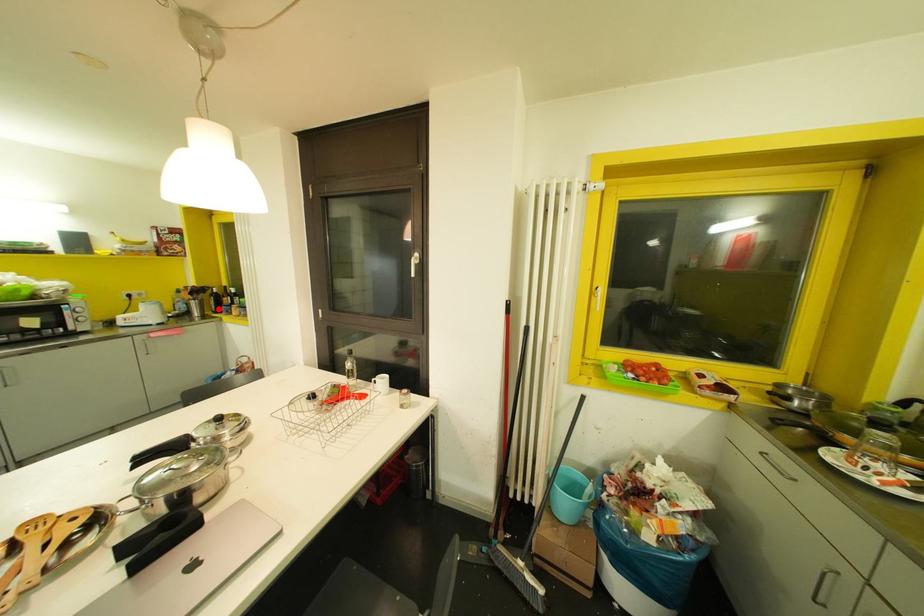
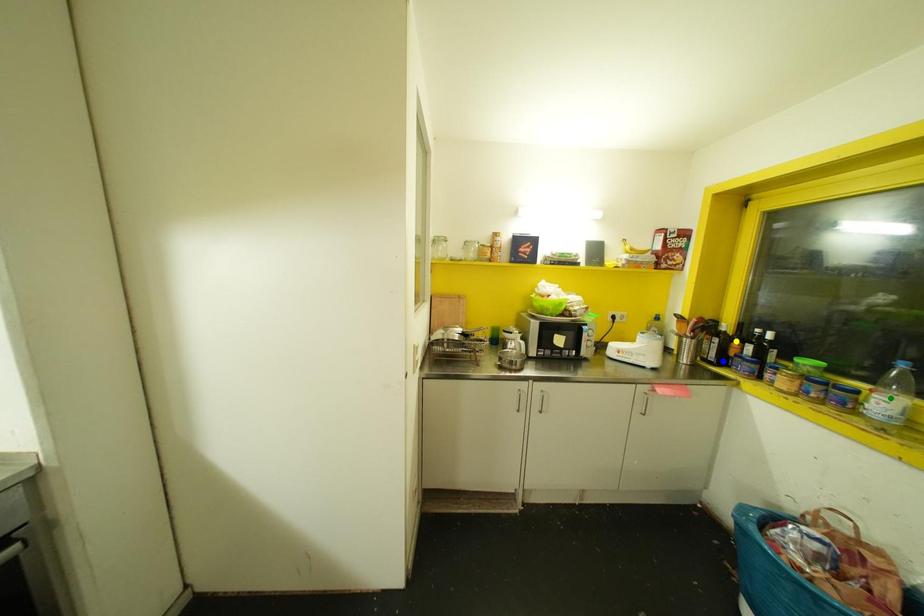
Question: I am providing you with two images of the same scene from different viewpoints. A red point is marked on the first image. You are given multiple points on the second image. Which mark in image 2 goes with the point in image 1?

Choices:
 (A) yellow point
 (B) green point
 (C) blue point

Answer: (C)